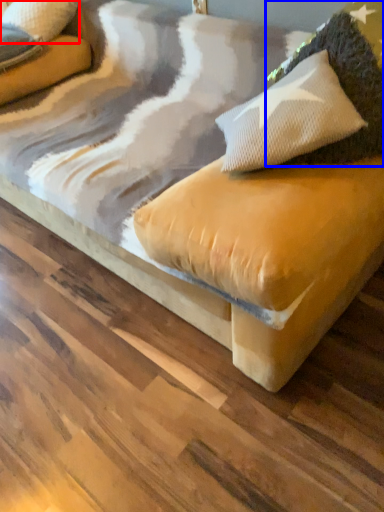
Question: Which point is further to the camera, pillow (highlighted by a red box) or pillow (highlighted by a blue box)?

Choices:
 (A) pillow
 (B) pillow

Answer: (A)